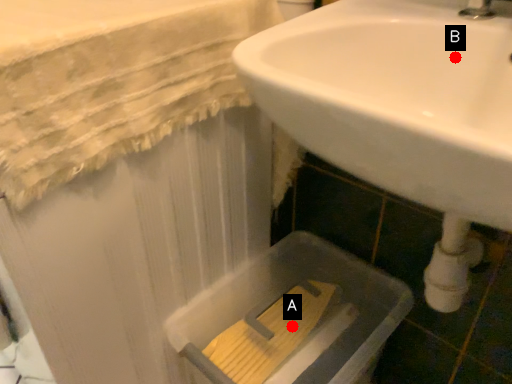
Question: Two points are circled on the image, labeled by A and B beside each circle. Which of the following is the closest to the observer?

Choices:
 (A) A is closer
 (B) B is closer

Answer: (B)